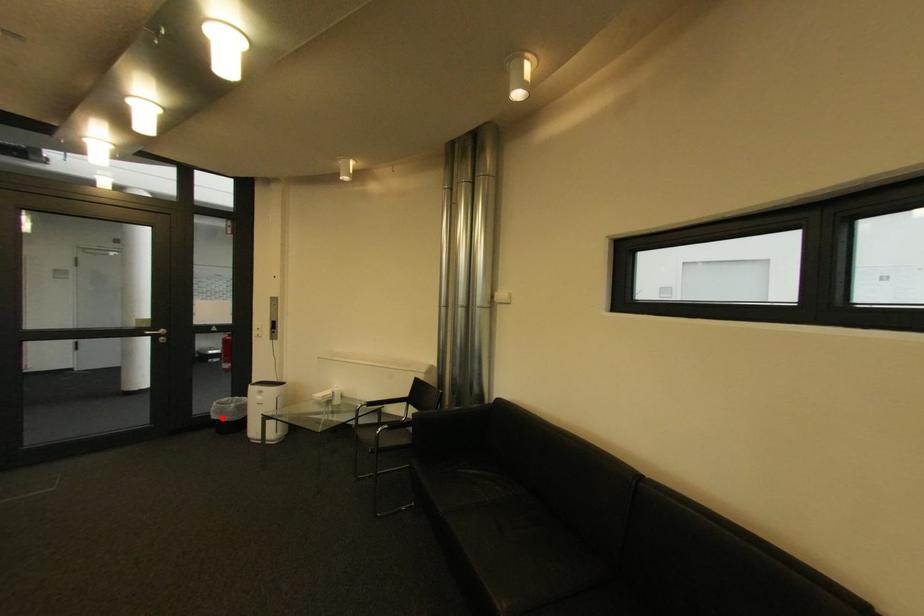
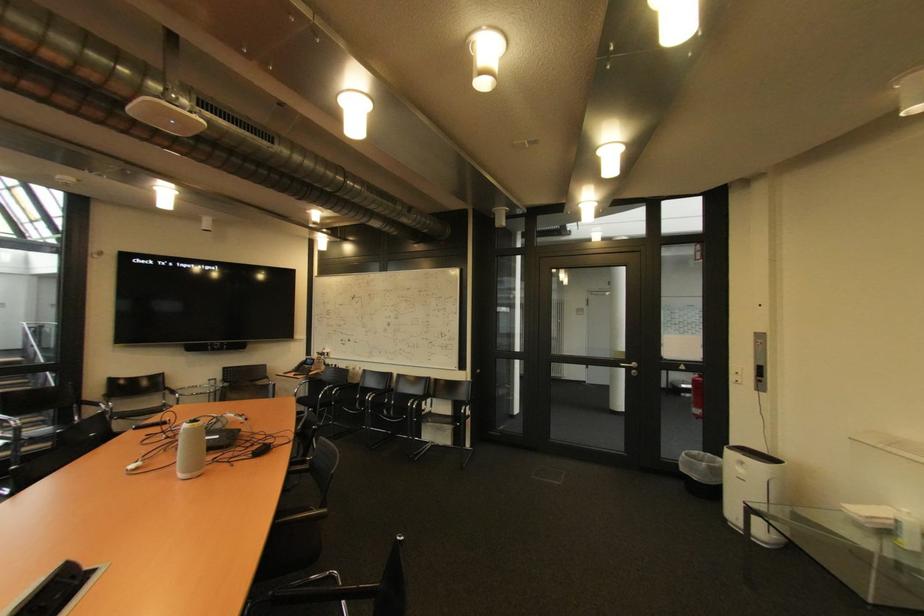
Find the pixel in the second image that matches the highlighted location in the first image.

(690, 471)